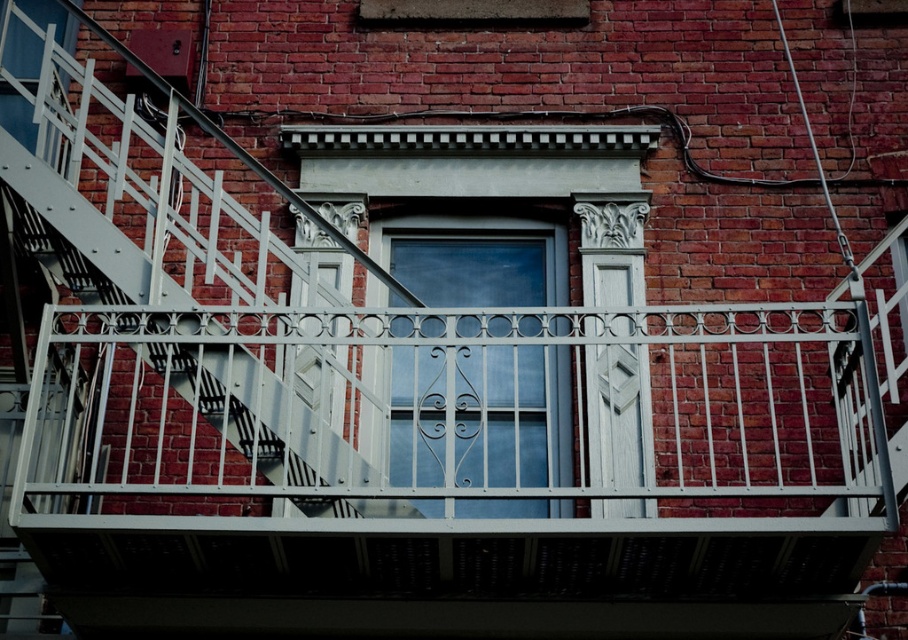
You are standing in front of the brick building and want to know which window is nearer to you. The clear glass window at center and the matte white window at upper left are both visible. Which one is closer?

The clear glass window at center is closer to the viewer than the matte white window at upper left.

You are standing in front of the brick building and want to know the exact position of the clear glass window at center. Can you determine its coordinates based on the image?

The clear glass window at center is located at point coordinates of [476,417].

You are an interior designer assessing the natural light in a building. You notice the clear glass window at center and the matte white window at upper left. Which window allows more sunlight into the room based on their sizes?

The clear glass window at center allows more sunlight into the room because its width is larger than the matte white window at upper left.